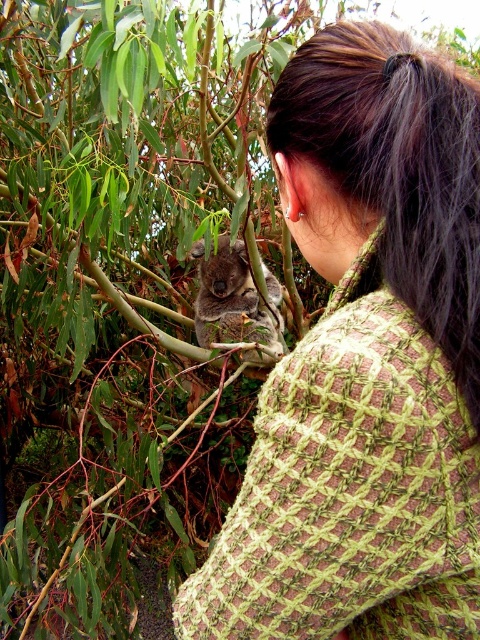
Who is taller, linen green shawl at upper right or gray furry koala at upper center?

linen green shawl at upper right

Can you confirm if linen green shawl at upper right is shorter than gray furry koala at upper center?

No.

Image resolution: width=480 pixels, height=640 pixels. Describe the element at coordinates (364, 364) in the screenshot. I see `linen green shawl at upper right` at that location.

This screenshot has width=480, height=640. Find the location of `linen green shawl at upper right`. linen green shawl at upper right is located at coordinates (364, 364).